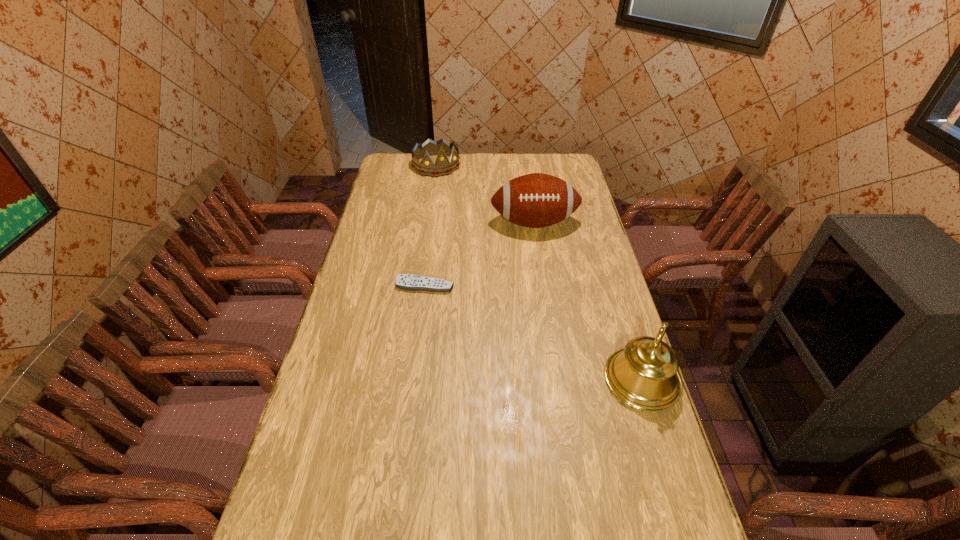
The image size is (960, 540). What are the coordinates of `vacant space at the near edge` in the screenshot? It's located at (x=515, y=535).

At what (x,y) coordinates should I click in order to perform the action: click on blank space at the left edge of the desktop. Please return your answer as a coordinate pair (x, y). Image resolution: width=960 pixels, height=540 pixels. Looking at the image, I should click on (382, 188).

Identify the location of free space at the right edge of the desktop. This screenshot has height=540, width=960. (585, 284).

Where is `free space at the far left corner`? This screenshot has height=540, width=960. free space at the far left corner is located at coordinates (407, 171).

The height and width of the screenshot is (540, 960). I want to click on free spot at the far right corner of the desktop, so click(568, 174).

This screenshot has height=540, width=960. What are the coordinates of `vacant area that lies between the remote control and the football` in the screenshot? It's located at (479, 254).

This screenshot has width=960, height=540. In order to click on unoccupied position between the farthest object and the remote control in this screenshot , I will do `click(430, 226)`.

This screenshot has height=540, width=960. I want to click on empty space that is in between the shortest object and the football, so click(479, 254).

Image resolution: width=960 pixels, height=540 pixels. I want to click on vacant area that lies between the remote control and the farthest object, so click(x=430, y=226).

The width and height of the screenshot is (960, 540). I want to click on empty space that is in between the third farthest object and the farthest object, so click(430, 226).